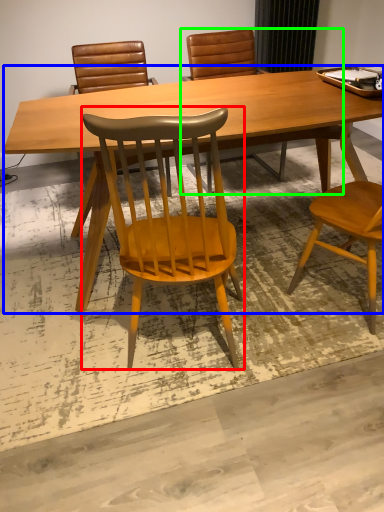
Question: Which object is positioned farthest from chair (highlighted by a red box)? Select from desk (highlighted by a blue box) and chair (highlighted by a green box).

Choices:
 (A) desk
 (B) chair

Answer: (B)